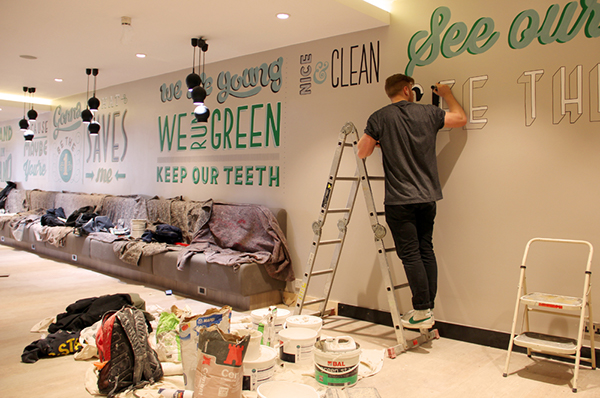
This screenshot has height=398, width=600. In order to click on ladder in this screenshot , I will do `click(373, 202)`.